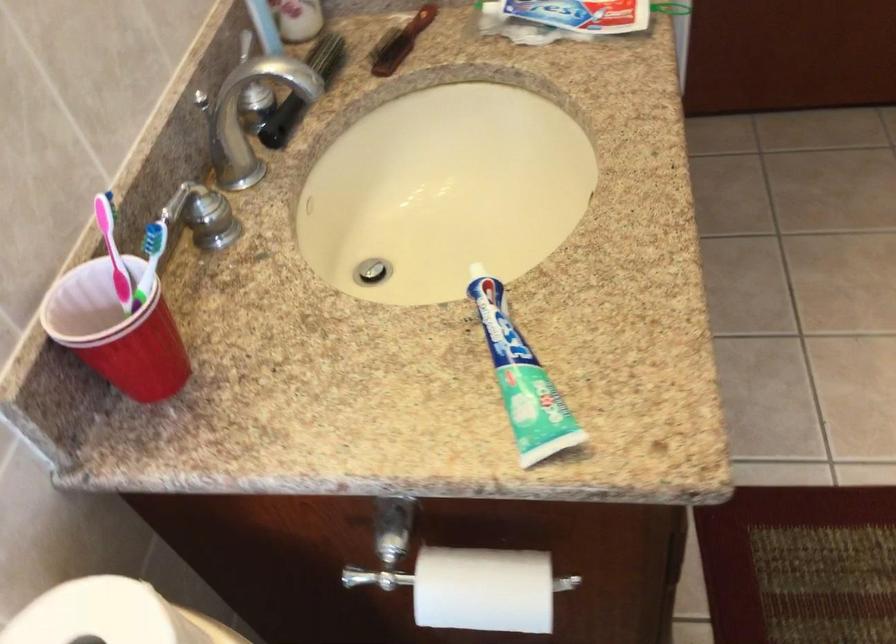
What do you see at coordinates (207, 212) in the screenshot?
I see `the faucet handle` at bounding box center [207, 212].